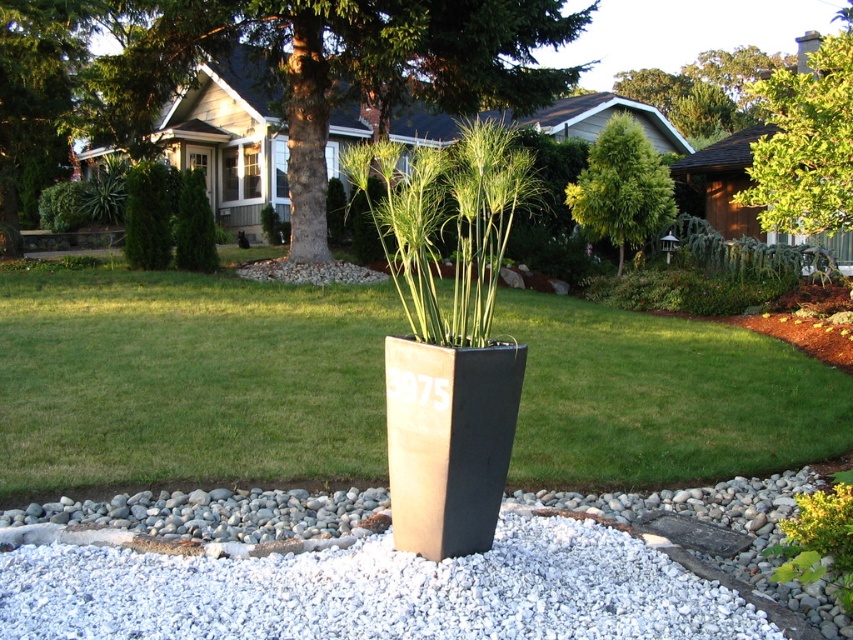
You are a bird looking for a place to perch. There are two trees in the scene, the green textured tree at center and the green leafy tree at upper right. Which tree is farther away from you?

The green leafy tree at upper right is farther away because it is positioned behind the green textured tree at center.

You are standing at the entrance of the suburban front yard and want to take a photo of the tall rectangular planter box with the plant and the number 3975. There is a point at coordinate point (41,70) in the image. If you move forward 10 meters towards that point, will the planter box still be visible in your view?

The distance of point (41,70) from viewer is 15.13 meters. Moving forward 10 meters would place you 5.13 meters away from the point. Since the planter box is part of the suburban front yard scene, it should remain visible as you move closer, unless there are obstructions not mentioned in the scene description.